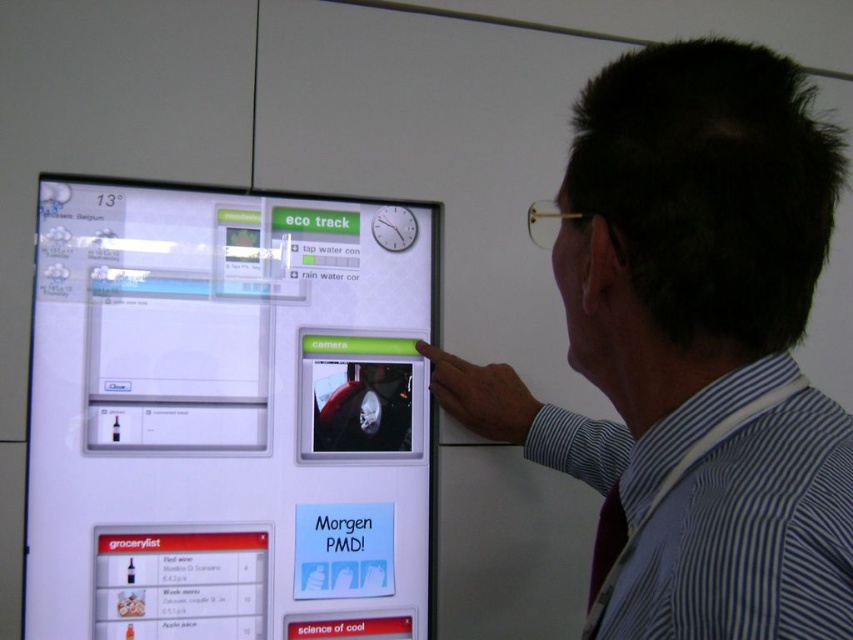
Question: Does transparent glass screen at upper left have a larger size compared to striped shirt at upper right?

Choices:
 (A) no
 (B) yes

Answer: (B)

Question: Which point is closer to the camera?

Choices:
 (A) (160, 484)
 (B) (762, 186)

Answer: (B)

Question: Among these points, which one is farthest from the camera?

Choices:
 (A) (689, 625)
 (B) (138, 275)

Answer: (B)

Question: Which of the following is the farthest from the observer?

Choices:
 (A) (844, 572)
 (B) (184, 385)

Answer: (B)

Question: Can you confirm if transparent glass screen at upper left is thinner than striped shirt at upper right?

Choices:
 (A) yes
 (B) no

Answer: (B)

Question: Does transparent glass screen at upper left lie behind striped shirt at upper right?

Choices:
 (A) no
 (B) yes

Answer: (B)